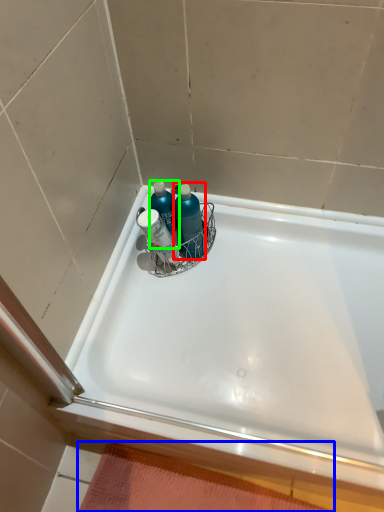
Question: Which is farther away from cleaning product (highlighted by a red box)? bath mat (highlighted by a blue box) or cleaning product (highlighted by a green box)?

Choices:
 (A) bath mat
 (B) cleaning product

Answer: (A)